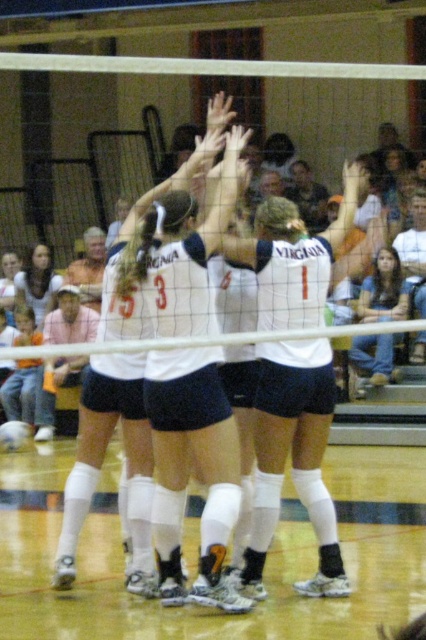
Is denim jeans at lower right wider than white textured volleyball at center?

Indeed, denim jeans at lower right has a greater width compared to white textured volleyball at center.

Is denim jeans at lower right smaller than white textured volleyball at center?

No.

Who is more distant from viewer, (373,305) or (5,436)?

Point (373,305)

Find the location of a particular element. This screenshot has height=640, width=426. denim jeans at lower right is located at coordinates (383, 291).

Which is in front, point (175, 552) or point (287, 449)?

Point (175, 552) is more forward.

Describe the element at coordinates (189, 467) in the screenshot. The height and width of the screenshot is (640, 426). I see `white matte volleyball net at center` at that location.

Where is `white matte volleyball net at center`? This screenshot has width=426, height=640. white matte volleyball net at center is located at coordinates (189, 467).

Based on the photo, between white matte jersey at center and matte black hair at lower left, which one appears on the left side from the viewer's perspective?

matte black hair at lower left

This screenshot has height=640, width=426. Describe the element at coordinates (293, 458) in the screenshot. I see `white matte jersey at center` at that location.

The image size is (426, 640). What are the coordinates of `white matte jersey at center` in the screenshot? It's located at (293, 458).